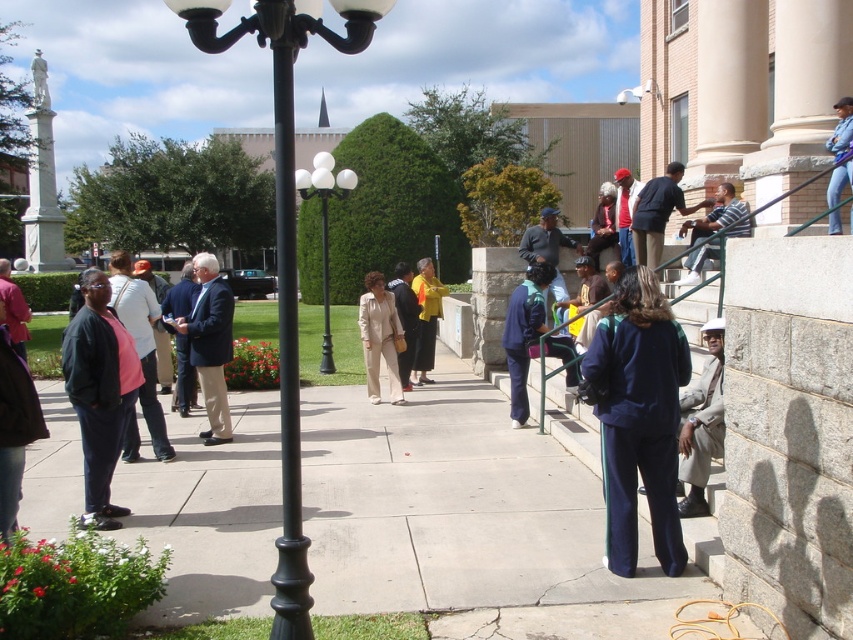
Question: Which point appears closest to the camera in this image?

Choices:
 (A) (32, 419)
 (B) (289, 387)
 (C) (633, 484)

Answer: (B)

Question: Does beige fabric suit at center appear on the left side of striped shirt at upper right?

Choices:
 (A) yes
 (B) no

Answer: (A)

Question: Among these points, which one is farthest from the camera?

Choices:
 (A) (405, 492)
 (B) (599, 221)
 (C) (213, 33)
 (D) (589, 369)

Answer: (B)

Question: Does dark blue suit at center have a larger size compared to matte blue jacket at upper right?

Choices:
 (A) yes
 (B) no

Answer: (B)

Question: Is light brown leather jacket at lower right smaller than striped shirt at upper right?

Choices:
 (A) yes
 (B) no

Answer: (A)

Question: Which point is closer to the camera taking this photo?

Choices:
 (A) (668, 422)
 (B) (163, 429)

Answer: (A)